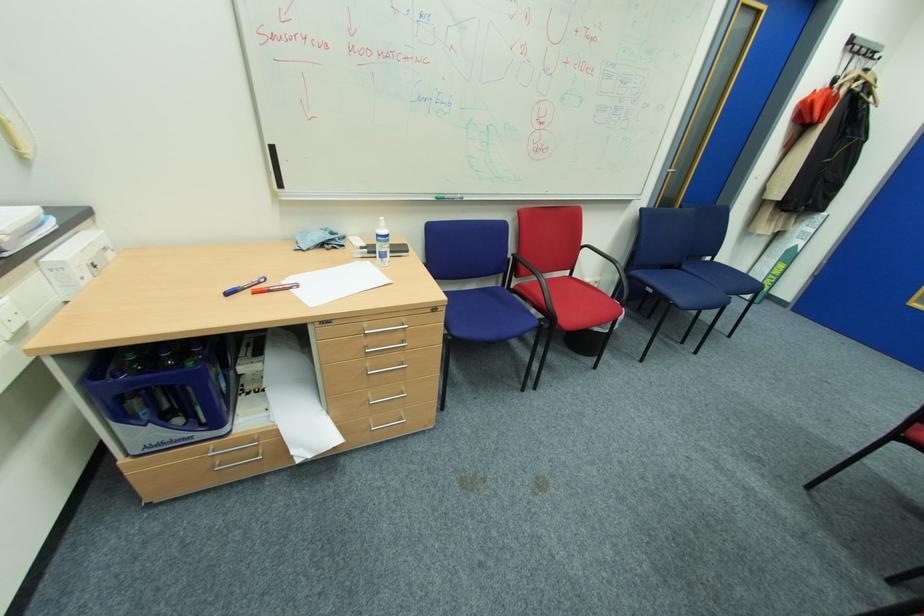
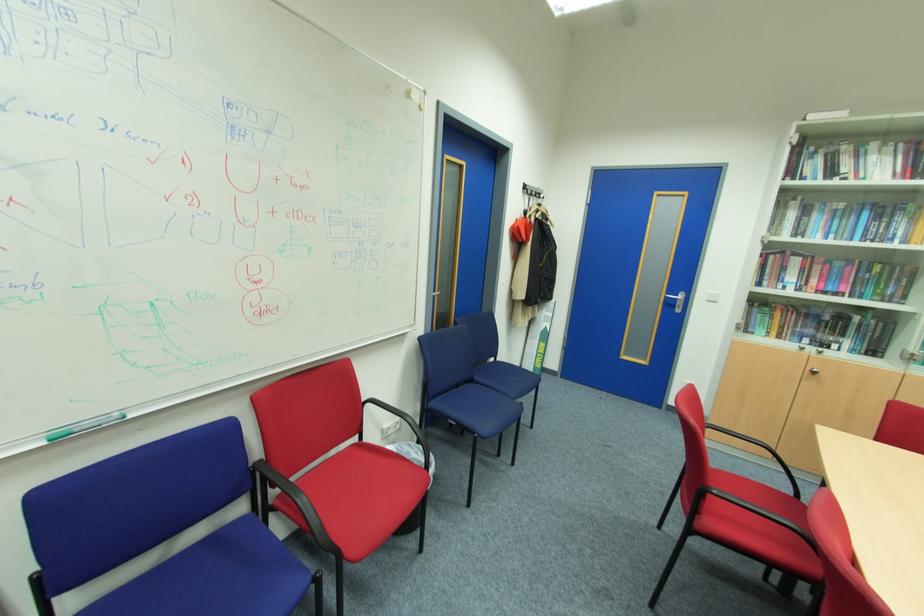
Locate, in the second image, the point that corresponds to point 586,245 in the first image.

(367, 400)